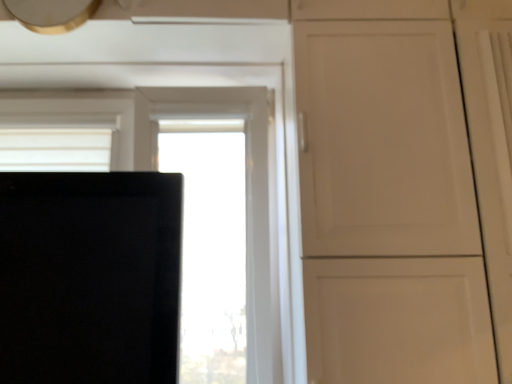
The height and width of the screenshot is (384, 512). Describe the element at coordinates (52, 14) in the screenshot. I see `metallic gold exhaust hood at upper left` at that location.

Locate an element on the screen. metallic gold exhaust hood at upper left is located at coordinates (52, 14).

Measure the distance between point (253, 359) and camera.

Point (253, 359) and camera are 1.47 meters apart from each other.

Where is `transparent glass window at center`? Image resolution: width=512 pixels, height=384 pixels. transparent glass window at center is located at coordinates (157, 165).

The image size is (512, 384). What do you see at coordinates (157, 165) in the screenshot?
I see `transparent glass window at center` at bounding box center [157, 165].

Find the location of a particular element. The width and height of the screenshot is (512, 384). metallic gold exhaust hood at upper left is located at coordinates (52, 14).

In the scene shown: Can you confirm if transparent glass window at center is positioned to the right of metallic gold exhaust hood at upper left?

Correct, you'll find transparent glass window at center to the right of metallic gold exhaust hood at upper left.

Which is in front, transparent glass window at center or metallic gold exhaust hood at upper left?

metallic gold exhaust hood at upper left is more forward.

Is point (39, 95) positioned behind point (54, 20)?

Yes, it is.

From the image's perspective, does transparent glass window at center appear lower than metallic gold exhaust hood at upper left?

Indeed, from the image's perspective, transparent glass window at center is shown beneath metallic gold exhaust hood at upper left.

Looking at this image, from a real-world perspective, is transparent glass window at center physically located above or below metallic gold exhaust hood at upper left?

In terms of real-world spatial position, transparent glass window at center is below metallic gold exhaust hood at upper left.

Looking at their sizes, would you say transparent glass window at center is wider or thinner than metallic gold exhaust hood at upper left?

transparent glass window at center is wider than metallic gold exhaust hood at upper left.

Does transparent glass window at center have a lesser height compared to metallic gold exhaust hood at upper left?

No, transparent glass window at center is not shorter than metallic gold exhaust hood at upper left.

Considering the sizes of transparent glass window at center and metallic gold exhaust hood at upper left in the image, is transparent glass window at center bigger or smaller than metallic gold exhaust hood at upper left?

Clearly, transparent glass window at center is larger in size than metallic gold exhaust hood at upper left.

Is metallic gold exhaust hood at upper left inside transparent glass window at center?

Actually, metallic gold exhaust hood at upper left is outside transparent glass window at center.

Are transparent glass window at center and metallic gold exhaust hood at upper left making contact?

No, transparent glass window at center is not beside metallic gold exhaust hood at upper left.

Is transparent glass window at center facing towards metallic gold exhaust hood at upper left?

Yes, transparent glass window at center is turned towards metallic gold exhaust hood at upper left.

Measure the distance between transparent glass window at center and metallic gold exhaust hood at upper left.

transparent glass window at center and metallic gold exhaust hood at upper left are 53.49 centimeters apart.

In order to click on exhaust hood that is above the transparent glass window at center (from the image's perspective) in this screenshot , I will do `click(52, 14)`.

Between metallic gold exhaust hood at upper left and transparent glass window at center, which one appears on the left side from the viewer's perspective?

metallic gold exhaust hood at upper left is more to the left.

Who is more distant, metallic gold exhaust hood at upper left or transparent glass window at center?

transparent glass window at center is further from the camera.

Considering the positions of points (89, 13) and (254, 141), is point (89, 13) closer to camera compared to point (254, 141)?

Yes, it is.

From the image's perspective, which is below, metallic gold exhaust hood at upper left or transparent glass window at center?

transparent glass window at center is shown below in the image.

From the picture: From a real-world perspective, who is located lower, metallic gold exhaust hood at upper left or transparent glass window at center?

In real-world perspective, transparent glass window at center is lower.

Considering the sizes of metallic gold exhaust hood at upper left and transparent glass window at center in the image, is metallic gold exhaust hood at upper left wider or thinner than transparent glass window at center?

Considering their sizes, metallic gold exhaust hood at upper left looks slimmer than transparent glass window at center.

From their relative heights in the image, would you say metallic gold exhaust hood at upper left is taller or shorter than transparent glass window at center?

Clearly, metallic gold exhaust hood at upper left is shorter compared to transparent glass window at center.

Considering the sizes of objects metallic gold exhaust hood at upper left and transparent glass window at center in the image provided, who is bigger, metallic gold exhaust hood at upper left or transparent glass window at center?

With larger size is transparent glass window at center.

Is metallic gold exhaust hood at upper left inside the boundaries of transparent glass window at center, or outside?

The correct answer is: outside.

Is metallic gold exhaust hood at upper left directly adjacent to transparent glass window at center?

Result: metallic gold exhaust hood at upper left and transparent glass window at center are not in contact.

Is metallic gold exhaust hood at upper left facing towards transparent glass window at center?

No, metallic gold exhaust hood at upper left is not oriented towards transparent glass window at center.

What's the angular difference between metallic gold exhaust hood at upper left and transparent glass window at center's facing directions?

They differ by 0.844 degrees in their facing directions.

Locate an element on the screen. The width and height of the screenshot is (512, 384). exhaust hood above the transparent glass window at center (from a real-world perspective) is located at coordinates (52, 14).

Where is `exhaust hood in front of the transparent glass window at center`? The width and height of the screenshot is (512, 384). exhaust hood in front of the transparent glass window at center is located at coordinates (52, 14).

Identify the location of exhaust hood above the transparent glass window at center (from a real-world perspective). (52, 14).